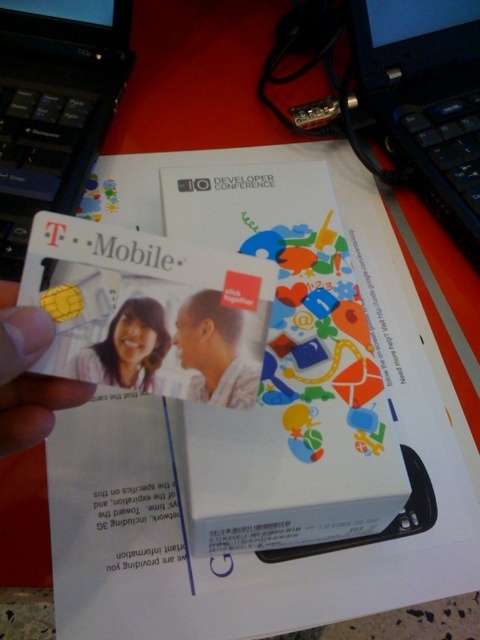
Is black plastic laptop at upper left shorter than matte plastic man at center?

No.

Is black plastic laptop at upper left closer to the viewer compared to matte plastic man at center?

That is False.

Between point (44, 141) and point (190, 342), which one is positioned in front?

Positioned in front is point (190, 342).

What are the coordinates of `black plastic laptop at upper left` in the screenshot? It's located at (54, 106).

Is black plastic laptop at upper left above matte plastic card at center?

Indeed, black plastic laptop at upper left is positioned over matte plastic card at center.

Between black plastic laptop at upper left and matte plastic card at center, which one is positioned higher?

black plastic laptop at upper left is higher up.

The width and height of the screenshot is (480, 640). Describe the element at coordinates (54, 106) in the screenshot. I see `black plastic laptop at upper left` at that location.

Locate an element on the screen. The height and width of the screenshot is (640, 480). black plastic laptop at upper left is located at coordinates (54, 106).

Does black plastic laptop at upper left have a greater height compared to black plastic laptop at upper right?

Incorrect, black plastic laptop at upper left's height is not larger of black plastic laptop at upper right's.

Is black plastic laptop at upper left wider than black plastic laptop at upper right?

No.

The width and height of the screenshot is (480, 640). What do you see at coordinates (54, 106) in the screenshot? I see `black plastic laptop at upper left` at bounding box center [54, 106].

Identify the location of black plastic laptop at upper left. The width and height of the screenshot is (480, 640). (54, 106).